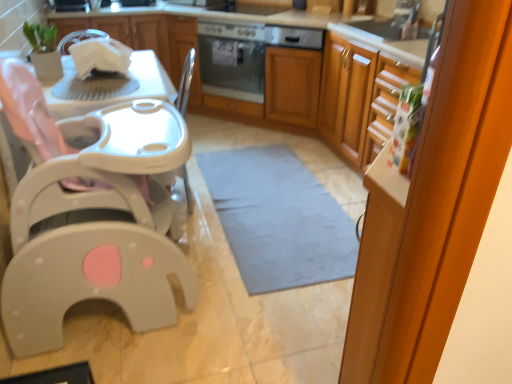
Question: Can satin silver oven at center be found inside white glossy cabinet at upper left, the 1th cabinetry when ordered from left to right?

Choices:
 (A) no
 (B) yes

Answer: (A)

Question: Is white glossy cabinet at upper left, the 1th cabinetry when ordered from left to right, at the right side of satin silver oven at center?

Choices:
 (A) yes
 (B) no

Answer: (B)

Question: From the image's perspective, is white glossy cabinet at upper left, the 2th cabinetry from the right, located above satin silver oven at center?

Choices:
 (A) yes
 (B) no

Answer: (A)

Question: Is white glossy cabinet at upper left, the 2th cabinetry from the right, to the left of satin silver oven at center from the viewer's perspective?

Choices:
 (A) no
 (B) yes

Answer: (B)

Question: Can you confirm if white glossy cabinet at upper left, the 1th cabinetry when ordered from left to right, is wider than satin silver oven at center?

Choices:
 (A) yes
 (B) no

Answer: (A)

Question: Considering the positions of point (x=109, y=18) and point (x=87, y=274), is point (x=109, y=18) closer or farther from the camera than point (x=87, y=274)?

Choices:
 (A) farther
 (B) closer

Answer: (A)

Question: Is white glossy cabinet at upper left, the 2th cabinetry from the right, bigger or smaller than white plastic baby carriage at left?

Choices:
 (A) big
 (B) small

Answer: (B)

Question: In the image, is white glossy cabinet at upper left, the 1th cabinetry when ordered from left to right, on the left side or the right side of white plastic baby carriage at left?

Choices:
 (A) right
 (B) left

Answer: (B)

Question: From the image's perspective, relative to white plastic baby carriage at left, is white glossy cabinet at upper left, the 1th cabinetry when ordered from left to right, above or below?

Choices:
 (A) above
 (B) below

Answer: (A)

Question: Does point (168, 192) appear closer or farther from the camera than point (130, 43)?

Choices:
 (A) farther
 (B) closer

Answer: (B)

Question: From a real-world perspective, is white plastic baby carriage at left physically located above or below white glossy cabinet at upper left, the 2th cabinetry from the right?

Choices:
 (A) above
 (B) below

Answer: (B)

Question: Relative to white glossy cabinet at upper left, the 2th cabinetry from the right, is white plastic baby carriage at left in front or behind?

Choices:
 (A) behind
 (B) front

Answer: (B)

Question: Is white plastic baby carriage at left wider or thinner than white glossy cabinet at upper left, the 1th cabinetry when ordered from left to right?

Choices:
 (A) wide
 (B) thin

Answer: (A)

Question: Relative to white glossy dishwasher at upper center, is gray fabric mat at center in front or behind?

Choices:
 (A) behind
 (B) front

Answer: (B)

Question: Is point (237, 258) closer or farther from the camera than point (311, 44)?

Choices:
 (A) closer
 (B) farther

Answer: (A)